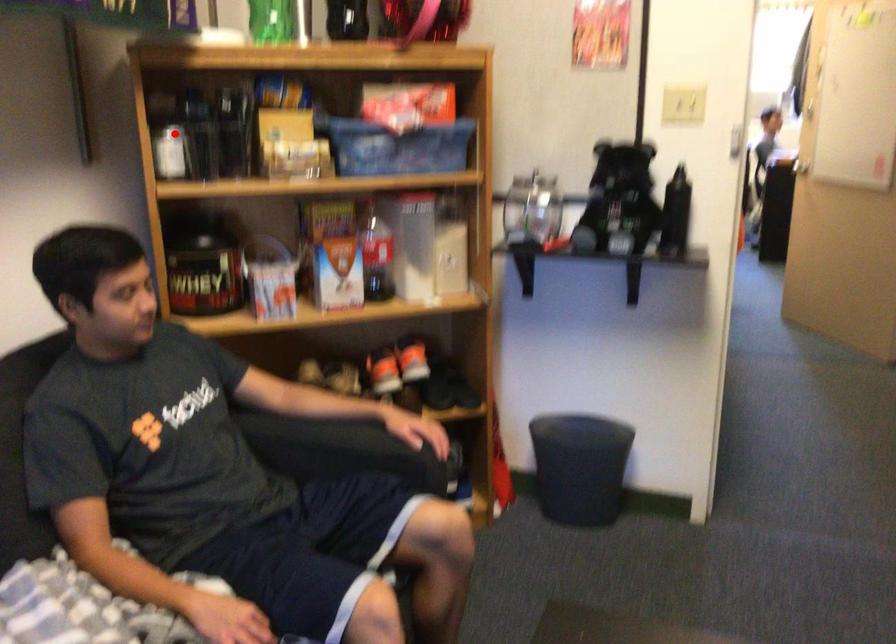
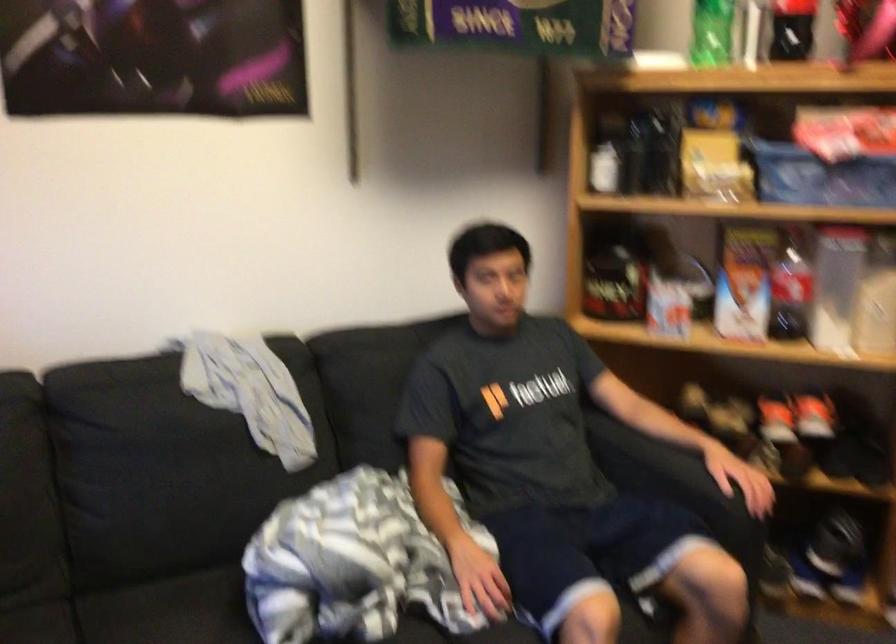
The point at the highlighted location is marked in the first image. Where is the corresponding point in the second image?

(607, 154)